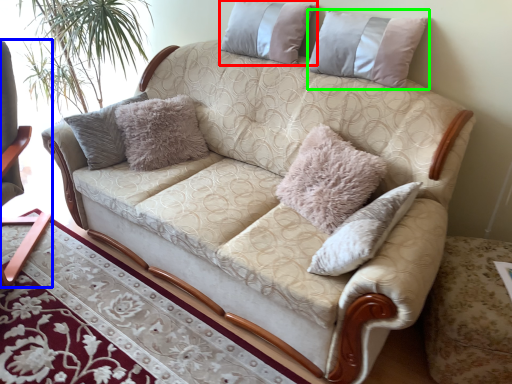
Question: Which object is positioned farthest from pillow (highlighted by a red box)? Select from rocking chair (highlighted by a blue box) and pillow (highlighted by a green box).

Choices:
 (A) rocking chair
 (B) pillow

Answer: (A)